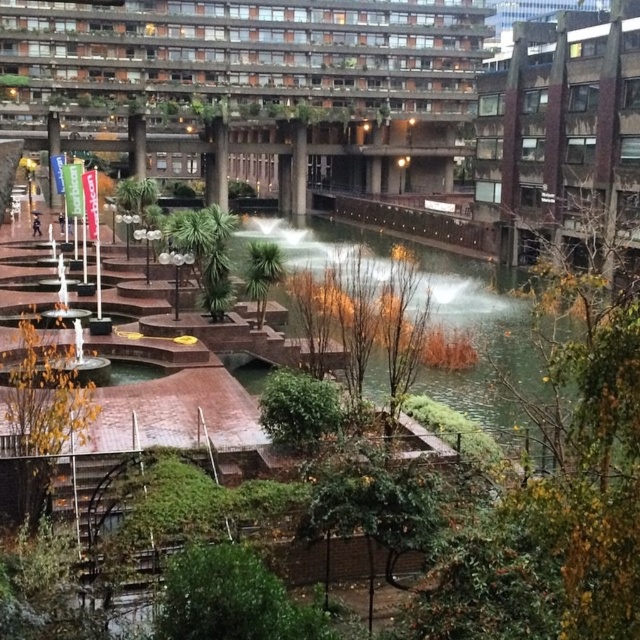
Question: Can you confirm if concrete fountain at left is bigger than brown concrete building at upper right?

Choices:
 (A) yes
 (B) no

Answer: (A)

Question: Which point appears farthest from the camera in this image?

Choices:
 (A) (552, 140)
 (B) (93, 77)

Answer: (B)

Question: Can you confirm if concrete fountain at left is bigger than brown concrete building at upper right?

Choices:
 (A) no
 (B) yes

Answer: (B)

Question: Which point is farther to the camera?

Choices:
 (A) concrete fountain at left
 (B) brown concrete building at upper right

Answer: (A)

Question: Is concrete fountain at left positioned at the back of brown concrete building at upper right?

Choices:
 (A) no
 (B) yes

Answer: (B)